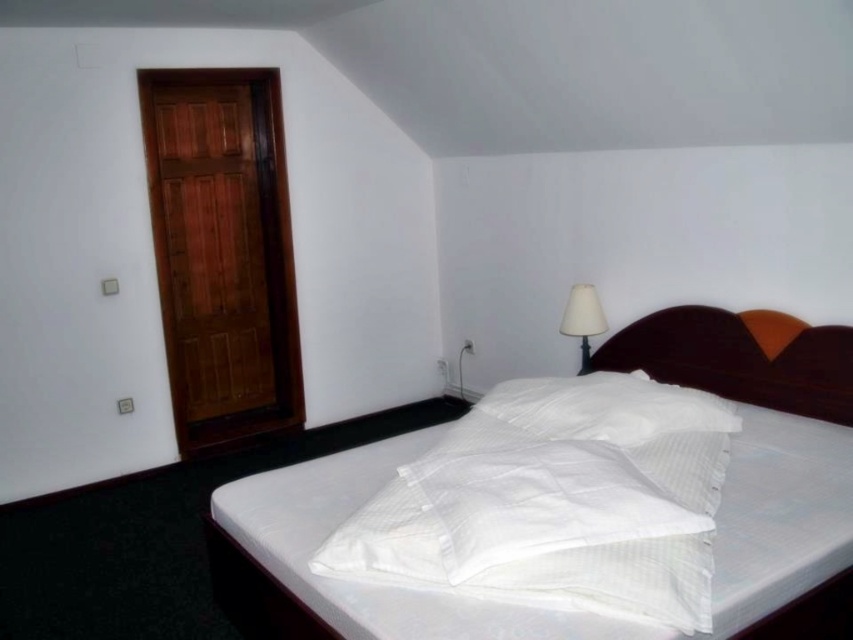
Does brown fabric headboard at upper right lie in front of white textured pillow at center?

No, it is behind white textured pillow at center.

Is brown fabric headboard at upper right to the right of white textured pillow at center from the viewer's perspective?

Correct, you'll find brown fabric headboard at upper right to the right of white textured pillow at center.

Between point (614, 346) and point (641, 412), which one is positioned in front?

Positioned in front is point (641, 412).

Locate an element on the screen. The image size is (853, 640). brown fabric headboard at upper right is located at coordinates (735, 360).

Is point (761, 620) farther from camera compared to point (514, 413)?

No, it is in front of (514, 413).

Consider the image. Between white striped bed at center and white textured pillow at center, which one has more height?

With more height is white striped bed at center.

Is point (216, 508) positioned behind point (585, 401)?

No, (216, 508) is closer to viewer.

In order to click on white striped bed at center in this screenshot , I will do `click(738, 360)`.

Is brown fabric headboard at upper right positioned before white fabric lampshade at upper right?

Yes.

Based on the photo, between brown fabric headboard at upper right and white fabric lampshade at upper right, which one appears on the right side from the viewer's perspective?

Positioned to the right is brown fabric headboard at upper right.

Where is `brown fabric headboard at upper right`? This screenshot has height=640, width=853. brown fabric headboard at upper right is located at coordinates (735, 360).